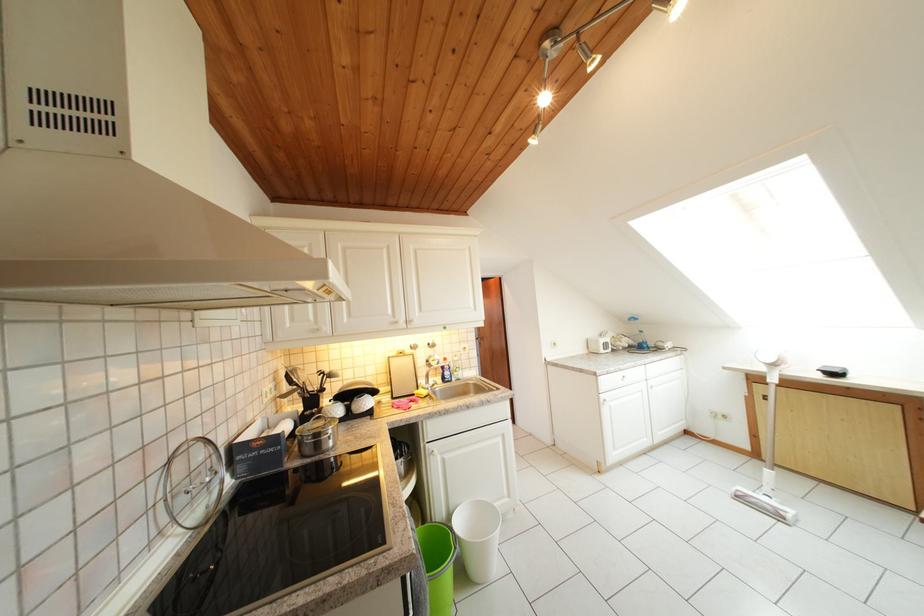
At what (x,y) coordinates should I click in order to perform the action: click on toaster lever. Please return your answer as a coordinate pair (x, y). The height and width of the screenshot is (616, 924). Looking at the image, I should click on (x=599, y=342).